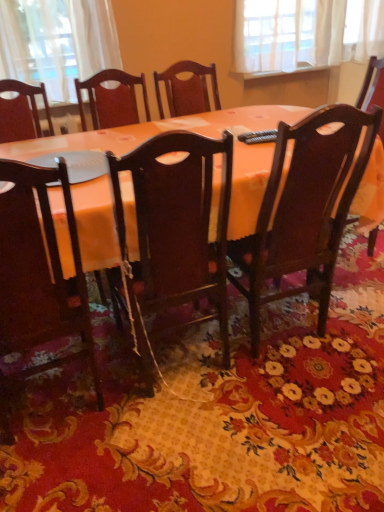
Find the location of a particular element. vacant space to the right of polished dark wood chair at center, the first chair viewed from the right is located at coordinates (352, 314).